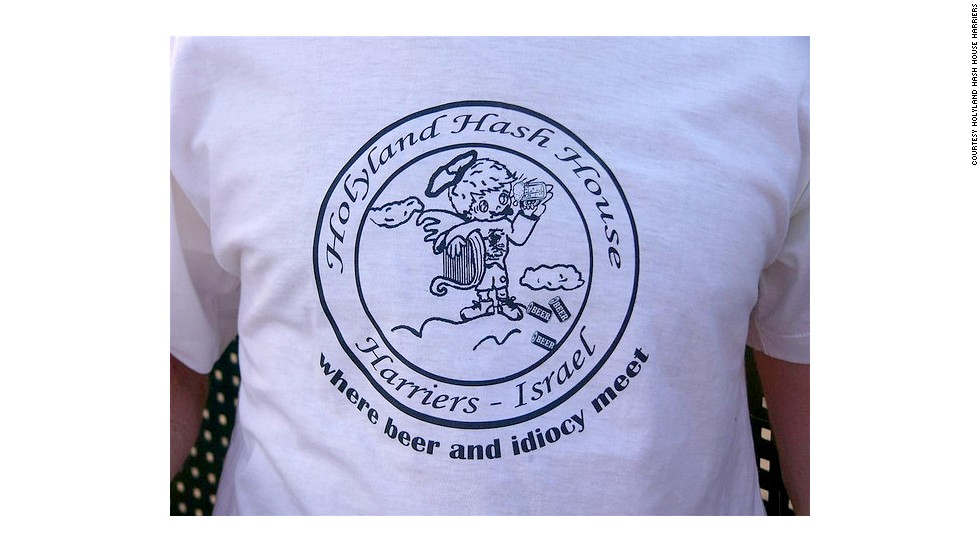
The width and height of the screenshot is (980, 552). What are the coordinates of `beer mug` in the screenshot? It's located at click(x=534, y=188).